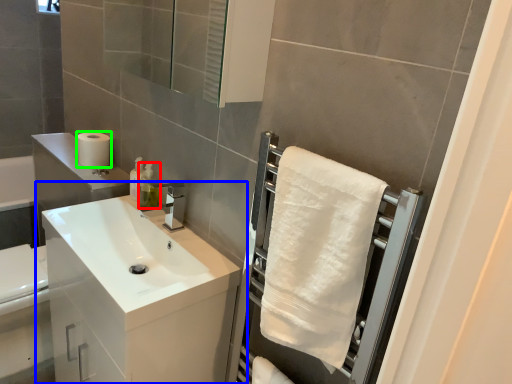
Question: Estimate the real-world distances between objects in this image. Which object is farther from soap dispenser (highlighted by a red box), bathroom cabinet (highlighted by a blue box) or toilet paper (highlighted by a green box)?

Choices:
 (A) bathroom cabinet
 (B) toilet paper

Answer: (A)